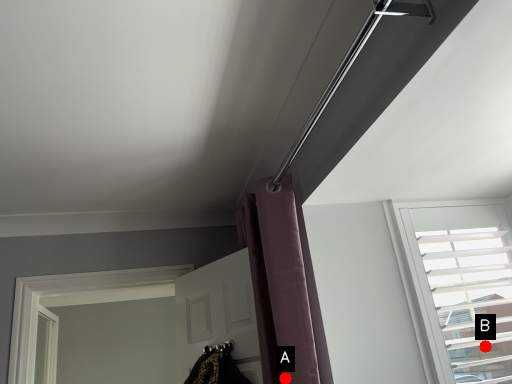
Question: Two points are circled on the image, labeled by A and B beside each circle. Which point appears farthest from the camera in this image?

Choices:
 (A) A is further
 (B) B is further

Answer: (B)